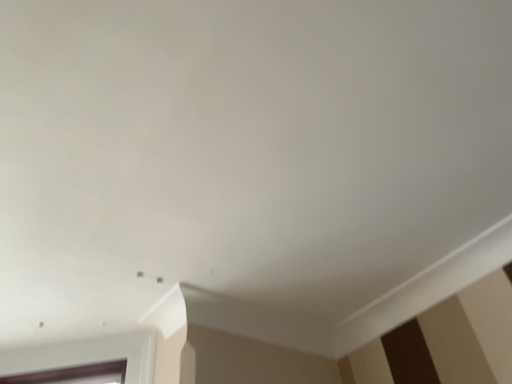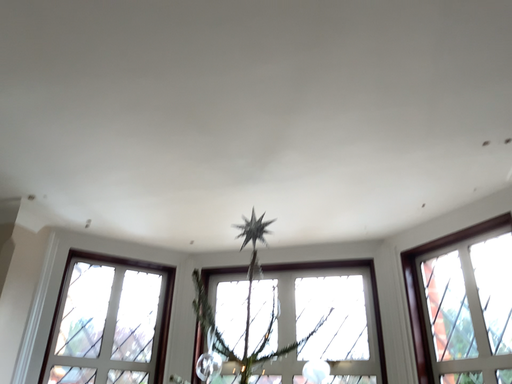
Question: How did the camera likely rotate when shooting the video?

Choices:
 (A) rotated downward
 (B) rotated upward

Answer: (A)